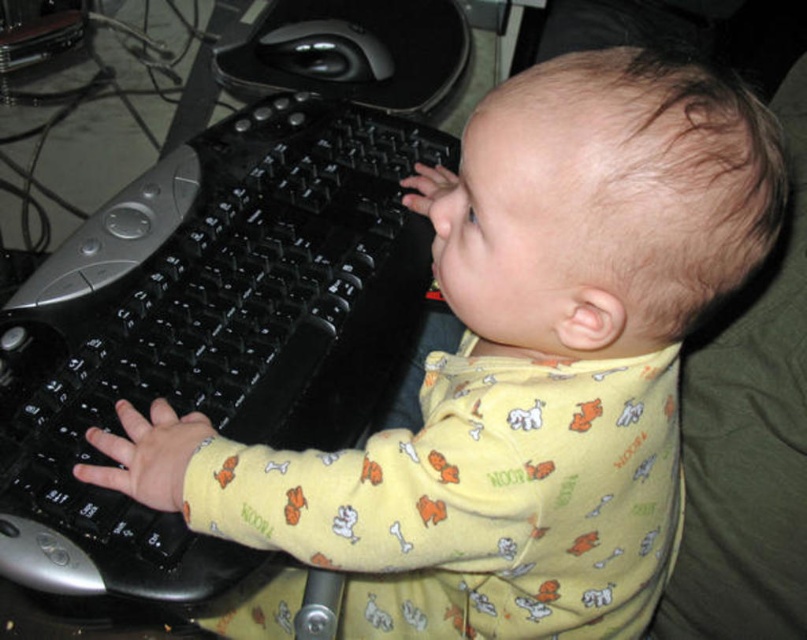
Question: Is black plastic keyboard at left in front of black glossy mouse at upper center?

Choices:
 (A) yes
 (B) no

Answer: (A)

Question: Is black plastic keyboard at left further to camera compared to black glossy mouse at upper center?

Choices:
 (A) no
 (B) yes

Answer: (A)

Question: Which object appears closest to the camera in this image?

Choices:
 (A) black plastic keyboard at left
 (B) black glossy mouse at upper center

Answer: (A)

Question: From the image, what is the correct spatial relationship of black plastic keyboard at left in relation to black glossy mouse at upper center?

Choices:
 (A) below
 (B) above

Answer: (A)

Question: Which of the following is the farthest from the observer?

Choices:
 (A) black glossy mouse at upper center
 (B) black plastic keyboard at left

Answer: (A)